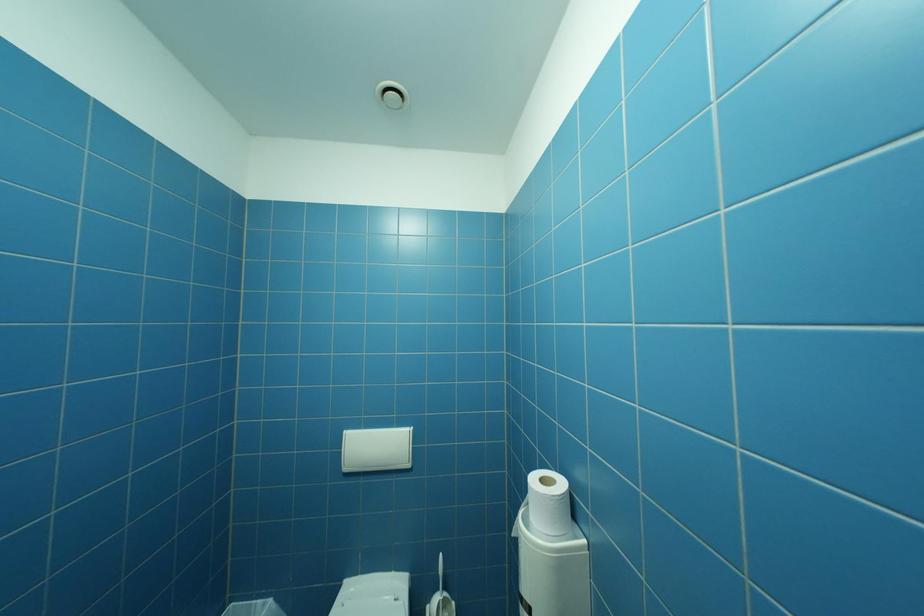
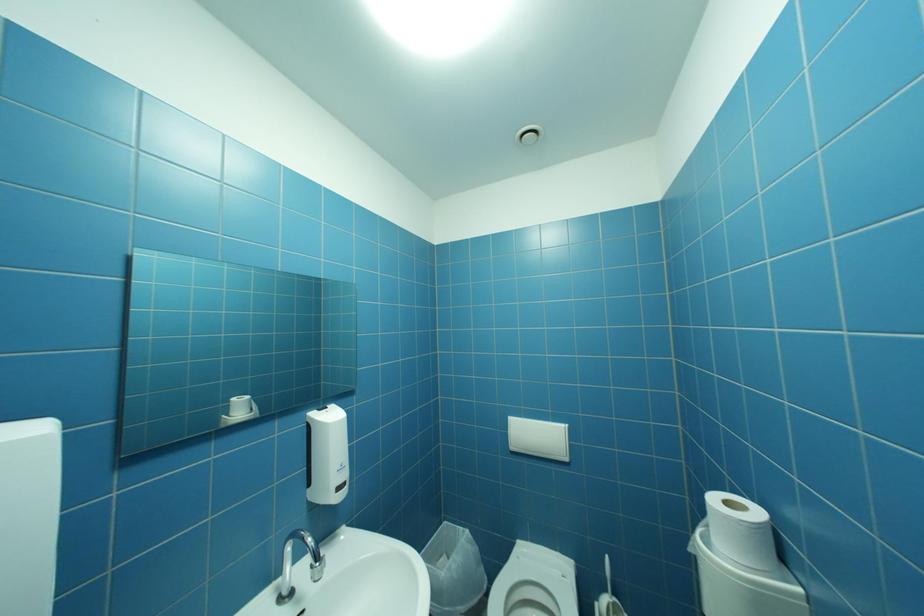
Question: The first image is from the beginning of the video and the second image is from the end. How did the camera likely rotate when shooting the video?

Choices:
 (A) Left
 (B) Right
 (C) Up
 (D) Down

Answer: (A)